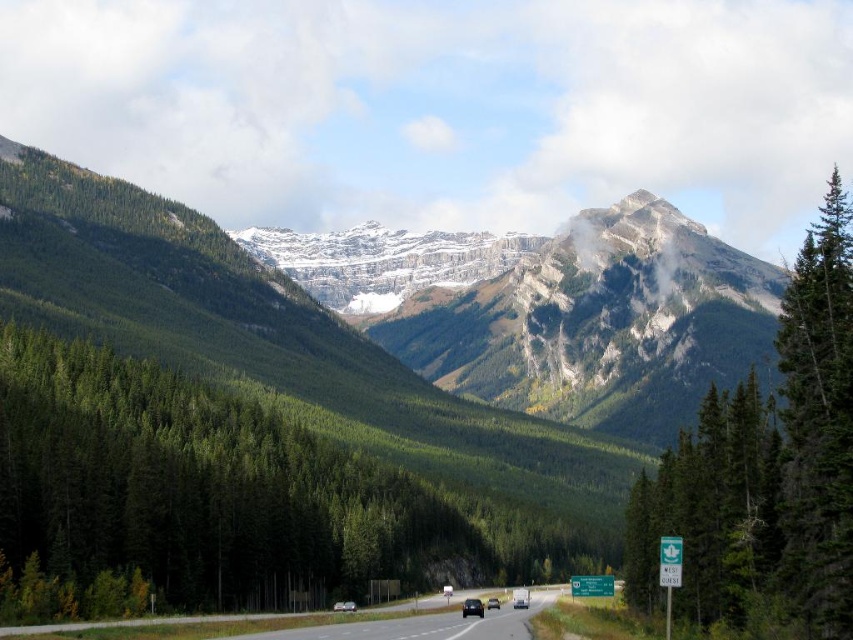
You are a hiker standing on the roadside looking at the green textured pine tree at right and the green textured tree at right. Which tree is positioned higher up in the image?

The green textured pine tree at right is located above the green textured tree at right in the image.

You are driving along the two lane highway in the mountainous landscape and see two points marked on the road ahead. The first point is at coordinates point (717, 524) and the second point is at point (439, 621). Which of these two points is closer to your current position?

Point (717, 524) is in front of point (439, 621), so the point (717, 524) is closer to your current position.